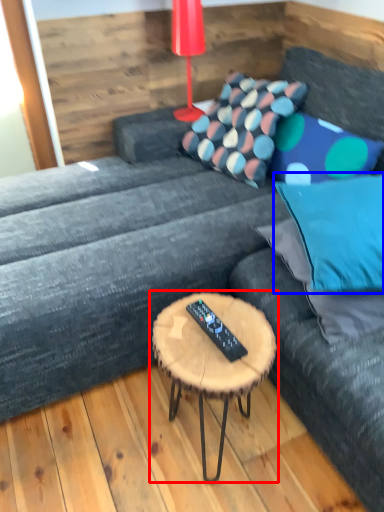
Question: Among these objects, which one is farthest to the camera, coffee table (highlighted by a red box) or pillow (highlighted by a blue box)?

Choices:
 (A) coffee table
 (B) pillow

Answer: (B)